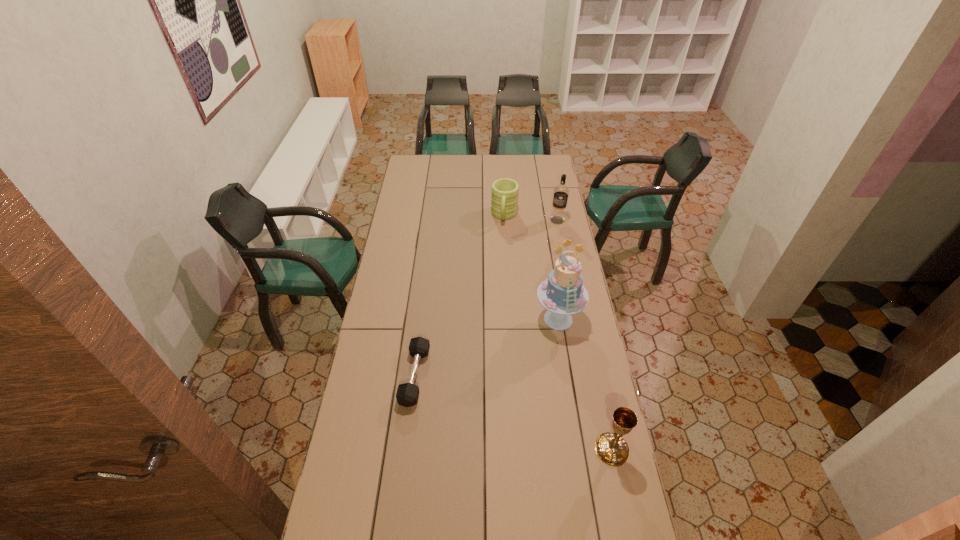
This screenshot has height=540, width=960. In order to click on vacant region located 0.330m on the left of the third shortest object in this screenshot , I will do `click(495, 449)`.

Identify the location of vacant space situated with a ladder on the side of the tallest object. (534, 397).

Find the location of a particular element. free space located with a ladder on the side of the tallest object is located at coordinates (532, 404).

The image size is (960, 540). I want to click on vacant space located 0.220m with a ladder on the side of the tallest object, so click(539, 382).

The height and width of the screenshot is (540, 960). I want to click on vacant space located on the side of the mug with the handle, so click(x=500, y=248).

Locate an element on the screen. blank space located 0.210m on the side of the mug with the handle is located at coordinates (500, 255).

In order to click on vacant position located on the side of the mug with the handle in this screenshot , I will do `click(502, 240)`.

Identify the location of vacant space situated on the label of the vodka. (539, 268).

The image size is (960, 540). Find the location of `vacant space located 0.070m on the label of the vodka`. vacant space located 0.070m on the label of the vodka is located at coordinates (552, 233).

Where is `free space located 0.260m on the label of the vodka`? The image size is (960, 540). free space located 0.260m on the label of the vodka is located at coordinates (543, 256).